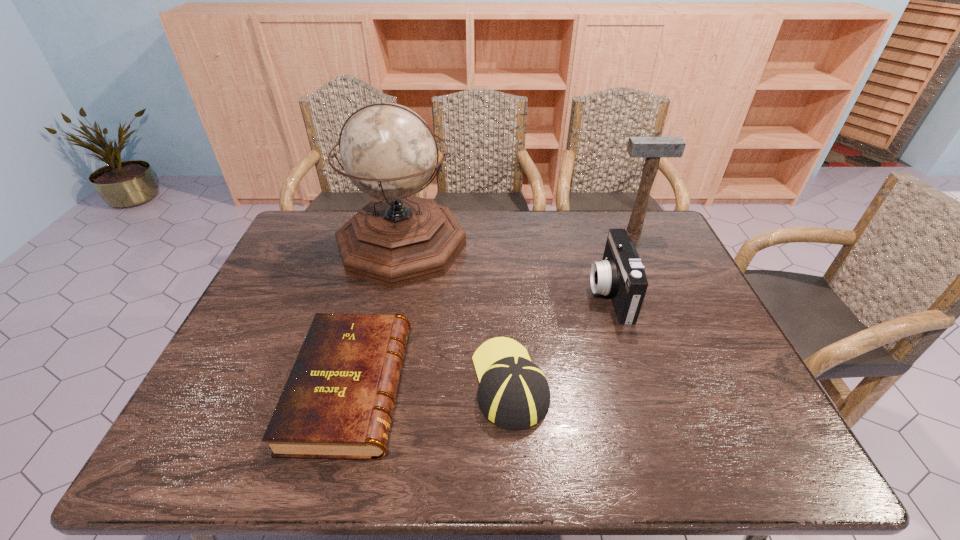
Select which object appears as the closest to the third object from right to left. Please provide its 2D coordinates. Your answer should be formatted as a tuple, i.e. [(x, y)], where the tuple contains the x and y coordinates of a point satisfying the conditions above.

[(337, 403)]

I want to click on vacant region that satisfies the following two spatial constraints: 1. with the brim of the fourth shortest object facing forward; 2. on the left side of the third object from right to left, so click(500, 230).

At what (x,y) coordinates should I click in order to perform the action: click on vacant position in the image that satisfies the following two spatial constraints: 1. with the brim of the fourth shortest object facing forward; 2. on the left side of the baseball cap. Please return your answer as a coordinate pair (x, y). This screenshot has height=540, width=960. Looking at the image, I should click on (500, 230).